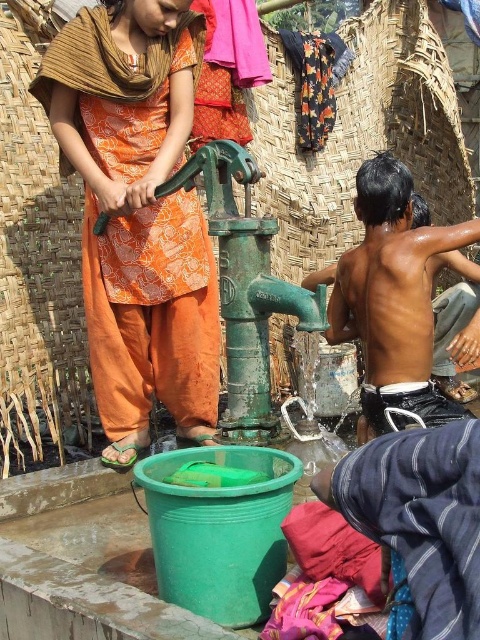
You are standing at the green hand pump and want to place a small toy between the two points labeled point (113, 221) and point (370, 419). Which point is closer to you so you can place the toy there first?

Point (113, 221) is closer to you than point (370, 419), so you should place the toy there first.

What is located at the point with coordinates (137,214) in the image?

The point at coordinates (137,214) marks the orange printed fabric at center.

You are a photographer trying to capture the scene of the woman and children. You notice the orange printed fabric at center and the shiny black skin at right. Which object should you focus on first to ensure it appears larger in your photo?

The orange printed fabric at center should be focused on first because it is closer to the viewer than the shiny black skin at right, making it appear larger in the photo.